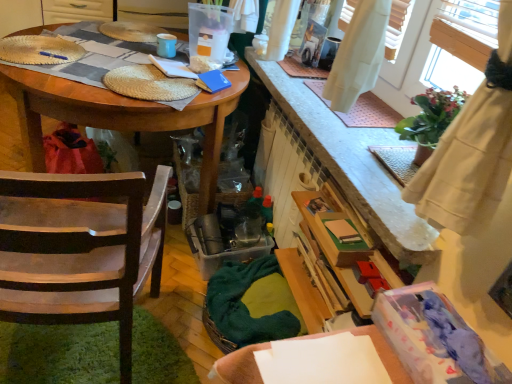
Question: Can you confirm if wooden chair at left is smaller than wooden table at left?

Choices:
 (A) no
 (B) yes

Answer: (B)

Question: From the image's perspective, is wooden chair at left on wooden table at left?

Choices:
 (A) yes
 (B) no

Answer: (B)

Question: Does wooden chair at left have a greater height compared to wooden table at left?

Choices:
 (A) yes
 (B) no

Answer: (A)

Question: Could you tell me if wooden chair at left is facing wooden table at left?

Choices:
 (A) no
 (B) yes

Answer: (B)

Question: Is wooden chair at left placed right next to wooden table at left?

Choices:
 (A) yes
 (B) no

Answer: (B)

Question: Does wooden chair at left have a lesser width compared to wooden table at left?

Choices:
 (A) no
 (B) yes

Answer: (B)

Question: Is wooden table at left with wooden chair at left?

Choices:
 (A) yes
 (B) no

Answer: (B)

Question: Can you confirm if wooden table at left is wider than wooden chair at left?

Choices:
 (A) yes
 (B) no

Answer: (A)

Question: Is wooden table at left far from wooden chair at left?

Choices:
 (A) yes
 (B) no

Answer: (B)

Question: Does wooden table at left come in front of wooden chair at left?

Choices:
 (A) no
 (B) yes

Answer: (A)

Question: From the image's perspective, does wooden table at left appear lower than wooden chair at left?

Choices:
 (A) yes
 (B) no

Answer: (B)

Question: From a real-world perspective, is wooden table at left positioned over wooden chair at left based on gravity?

Choices:
 (A) no
 (B) yes

Answer: (A)

Question: Does point (25, 158) appear closer or farther from the camera than point (70, 192)?

Choices:
 (A) farther
 (B) closer

Answer: (A)